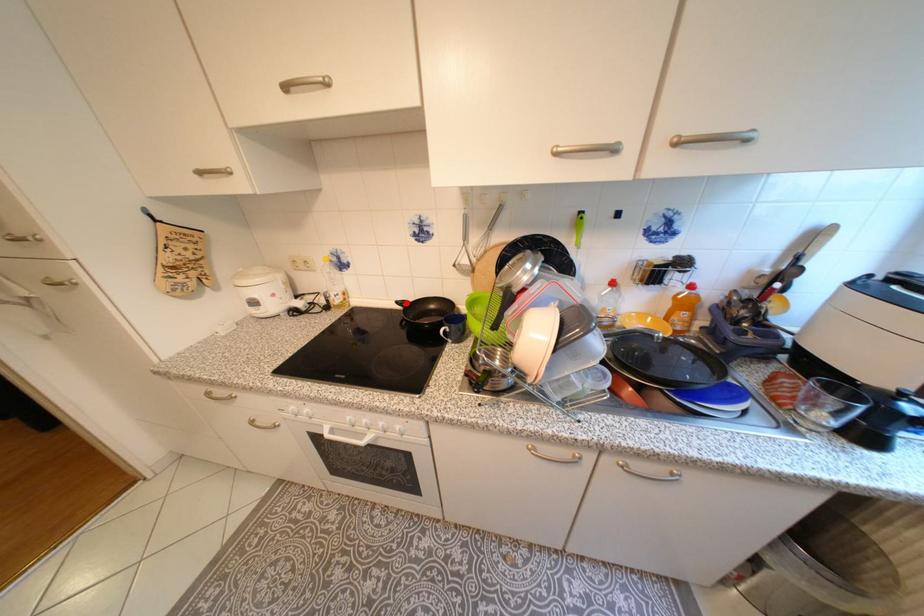
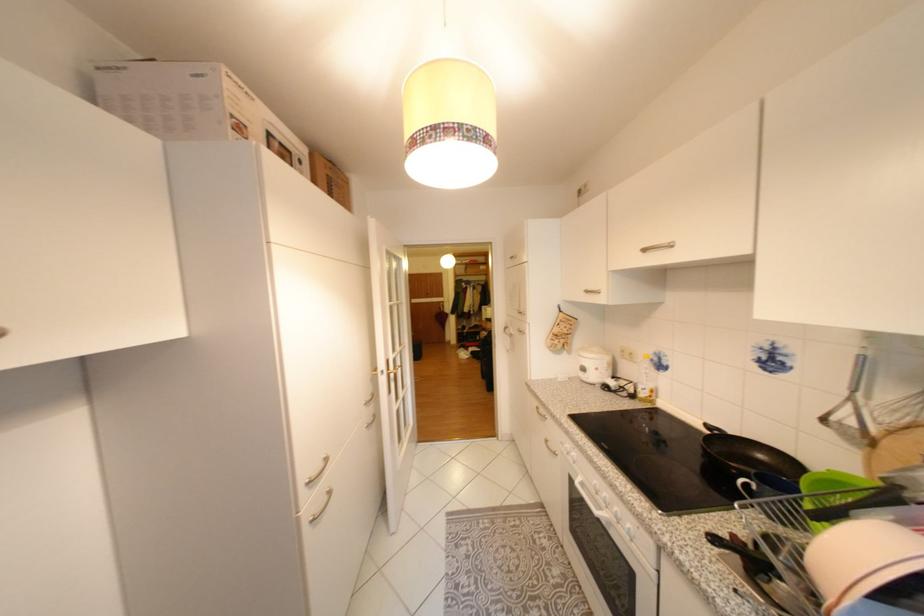
In the second image, find the point that corresponds to the highlighted location in the first image.

(715, 426)